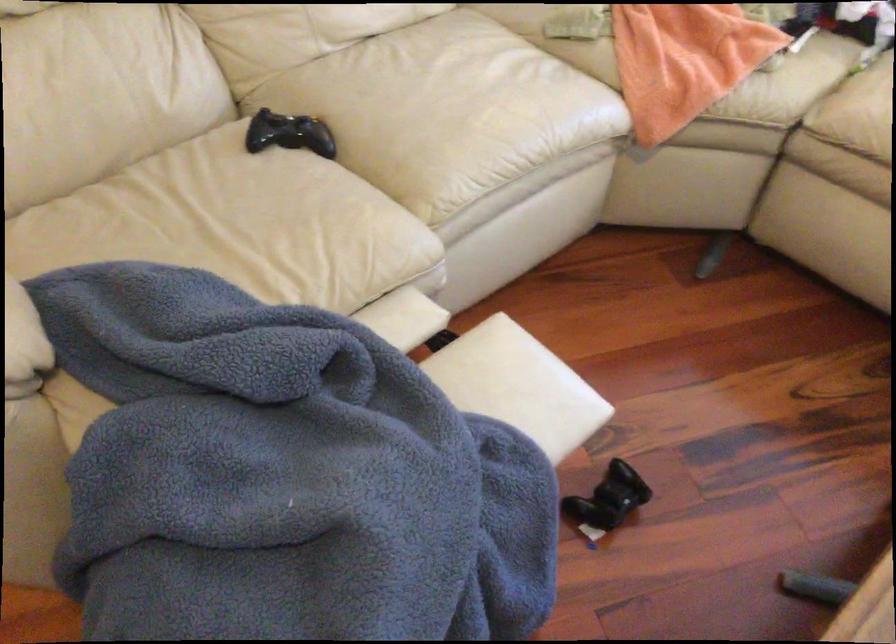
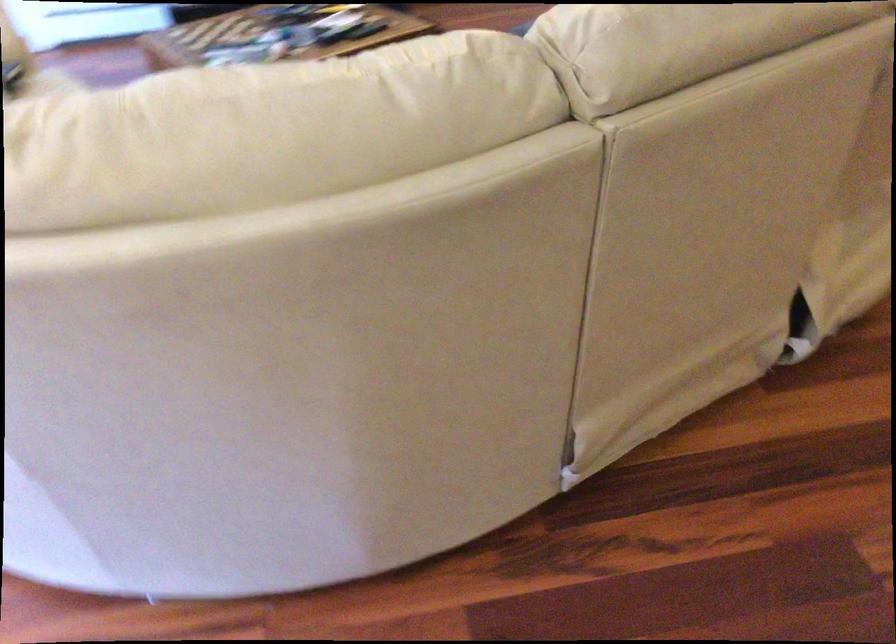
Question: I am providing you with two images of the same scene from different viewpoints. Please identify which objects are invisible in image2.

Choices:
 (A) white sofa cushion
 (B) blue plastic bottle
 (C) sofa sitting surface
 (D) sofa armrest

Answer: (A)